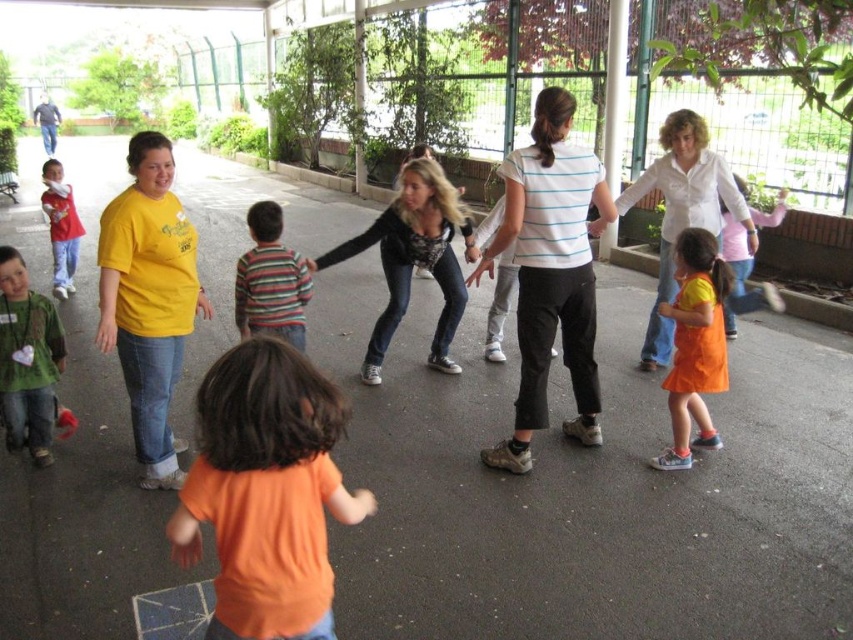
You are organizing a costume party and need to decide which outfit to use for a giant character. The orange fabric dress at lower right and the striped cotton shirt at center are available. Based on their sizes, which one would be more suitable for the giant character?

The orange fabric dress at lower right is larger in size compared to the striped cotton shirt at center, making it more suitable for the giant character.

You are standing at the center of the paved area and want to locate the orange fabric dress at lower right. According to the coordinates provided, in which direction should you move to find it?

The orange fabric dress at lower right is located at point (694, 344). Since you are at the center, you should move towards the lower right direction to find it.